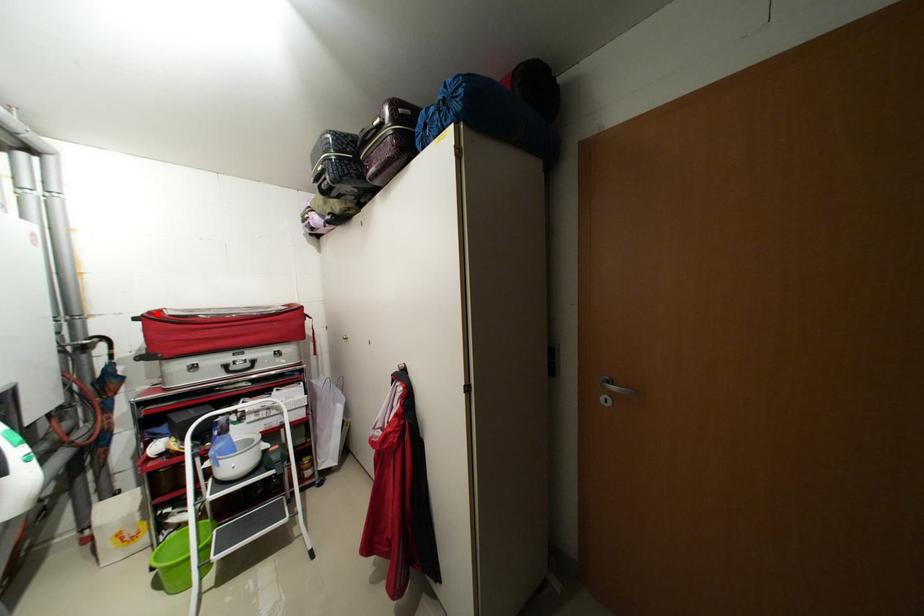
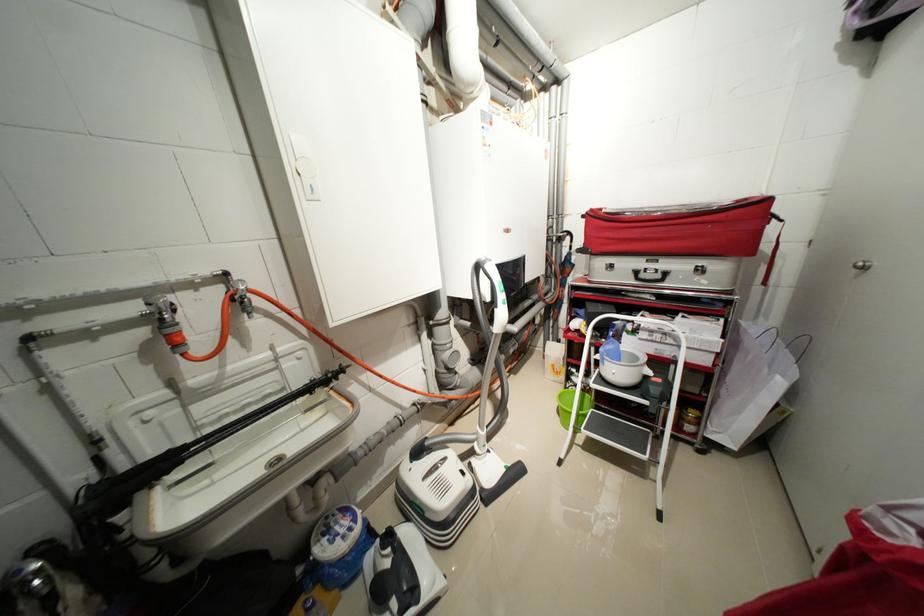
Question: I am providing you with two images of the same scene from different viewpoints. In image1, a red point is highlighted. Considering the same 3D point in image2, which of the following is correct?

Choices:
 (A) It is closer
 (B) It is farther

Answer: (A)